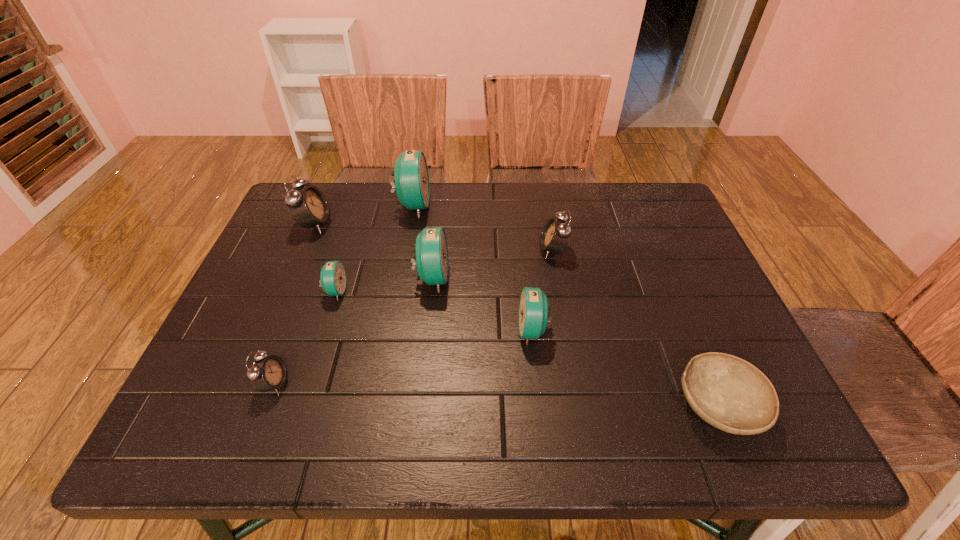
Locate an element on the screen. white alarm clock that is the closest to the nearest white alarm clock is located at coordinates point(308,206).

Point out which white alarm clock is positioned as the nearest to the bowl. Please provide its 2D coordinates. Your answer should be formatted as a tuple, i.e. [(x, y)], where the tuple contains the x and y coordinates of a point satisfying the conditions above.

[(555, 235)]

Find the location of `free space that satisfies the following two spatial constraints: 1. on the back side of the gray bowl; 2. on the face of the nearest white alarm clock`. free space that satisfies the following two spatial constraints: 1. on the back side of the gray bowl; 2. on the face of the nearest white alarm clock is located at coordinates (708, 384).

Where is `vacant space that satisfies the following two spatial constraints: 1. on the face of the biggest white alarm clock; 2. on the left side of the gray bowl`? This screenshot has height=540, width=960. vacant space that satisfies the following two spatial constraints: 1. on the face of the biggest white alarm clock; 2. on the left side of the gray bowl is located at coordinates (238, 406).

Where is `vacant space that satisfies the following two spatial constraints: 1. on the front-facing side of the gray bowl; 2. on the right side of the tallest object`? The width and height of the screenshot is (960, 540). vacant space that satisfies the following two spatial constraints: 1. on the front-facing side of the gray bowl; 2. on the right side of the tallest object is located at coordinates (376, 406).

Where is `free space that satisfies the following two spatial constraints: 1. on the face of the nearest white alarm clock; 2. on the left side of the gray bowl`? free space that satisfies the following two spatial constraints: 1. on the face of the nearest white alarm clock; 2. on the left side of the gray bowl is located at coordinates (266, 406).

At what (x,y) coordinates should I click in order to perform the action: click on free space that satisfies the following two spatial constraints: 1. on the face of the smallest white alarm clock; 2. on the back side of the bowl. Please return your answer as a coordinate pair (x, y). The width and height of the screenshot is (960, 540). Looking at the image, I should click on (266, 406).